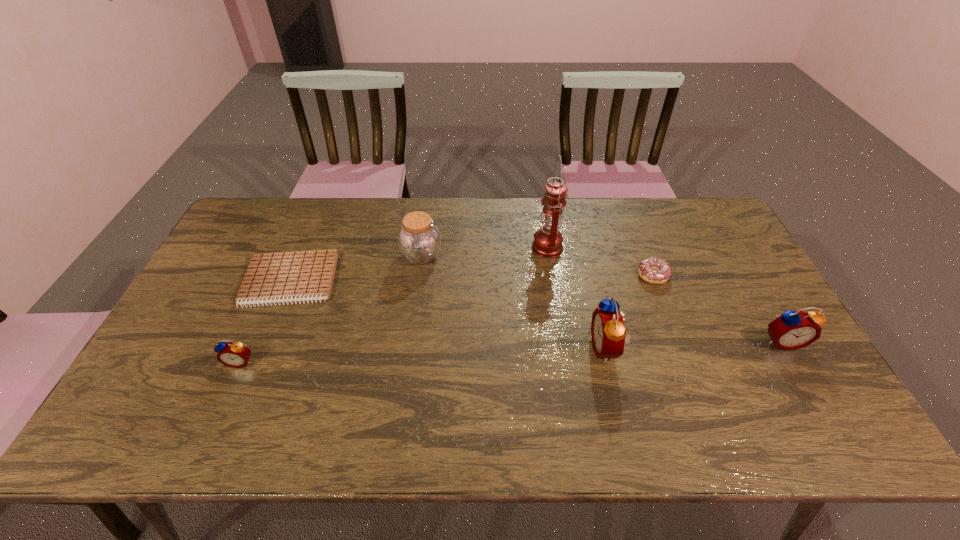
Find the location of a particular element. Image resolution: width=960 pixels, height=540 pixels. free space between the doughnut and the third object from left to right is located at coordinates (538, 265).

The width and height of the screenshot is (960, 540). What are the coordinates of `vacant region between the doughnut and the third object from left to right` in the screenshot? It's located at (538, 265).

At what (x,y) coordinates should I click in order to perform the action: click on free space that is in between the leftmost alarm clock and the doughnut. Please return your answer as a coordinate pair (x, y). The image size is (960, 540). Looking at the image, I should click on click(447, 319).

This screenshot has height=540, width=960. In order to click on empty space between the shortest alarm clock and the oil lamp in this screenshot , I will do `click(394, 304)`.

Locate an element on the screen. vacant space in between the second shortest alarm clock and the fourth object from right to left is located at coordinates (664, 294).

Identify the location of free space between the second shortest alarm clock and the second alarm clock from right to left. Image resolution: width=960 pixels, height=540 pixels. (694, 345).

The height and width of the screenshot is (540, 960). In order to click on free spot between the shortest object and the leftmost alarm clock in this screenshot , I will do `click(266, 321)`.

The image size is (960, 540). I want to click on free area in between the shortest object and the third object from right to left, so click(448, 314).

Locate which object ranks fifth in proximity to the second alarm clock from right to left. Please provide its 2D coordinates. Your answer should be formatted as a tuple, i.e. [(x, y)], where the tuple contains the x and y coordinates of a point satisfying the conditions above.

[(279, 277)]

This screenshot has height=540, width=960. What are the coordinates of `object that is the fifth closest to the jar` in the screenshot? It's located at (653, 270).